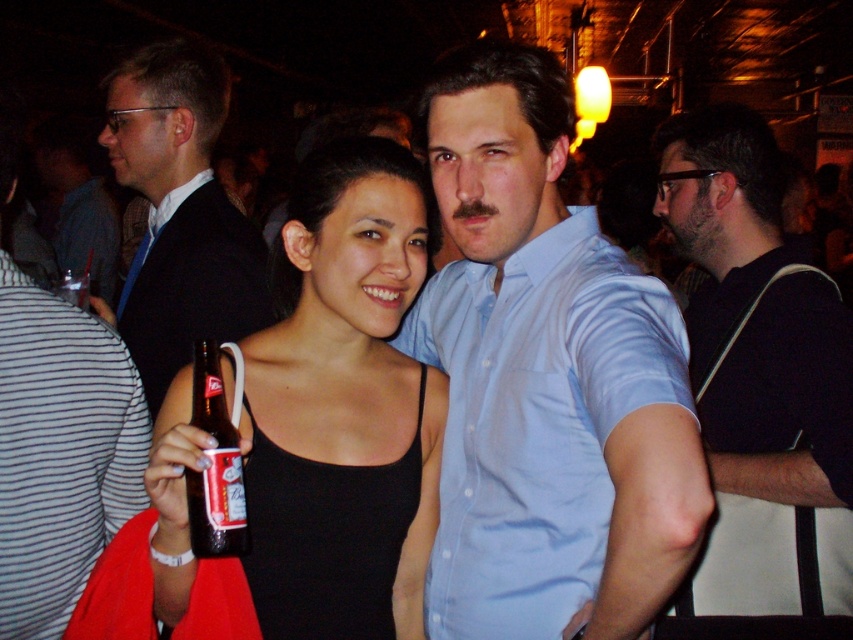
Question: Does light blue shirt at center appear on the left side of matte black suit at left?

Choices:
 (A) yes
 (B) no

Answer: (B)

Question: Which is nearer to the black matte tank top at center?

Choices:
 (A) striped fabric shirt at left
 (B) light blue shirt at center

Answer: (B)

Question: From the image, what is the correct spatial relationship of light blue shirt at center in relation to brown glass bottle at center?

Choices:
 (A) above
 (B) below

Answer: (A)

Question: Can you confirm if black matte tank top at center is smaller than striped fabric shirt at left?

Choices:
 (A) no
 (B) yes

Answer: (A)

Question: Which point is closer to the camera taking this photo?

Choices:
 (A) (293, 464)
 (B) (190, 221)
 (C) (769, 624)

Answer: (A)

Question: Which object appears farthest from the camera in this image?

Choices:
 (A) light blue shirt at center
 (B) brown glass bottle at center

Answer: (B)